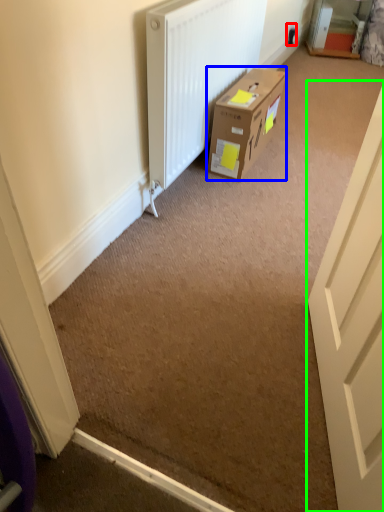
Question: Considering the real-world distances, which object is closest to electric outlet (highlighted by a red box)? box (highlighted by a blue box) or door (highlighted by a green box).

Choices:
 (A) box
 (B) door

Answer: (A)